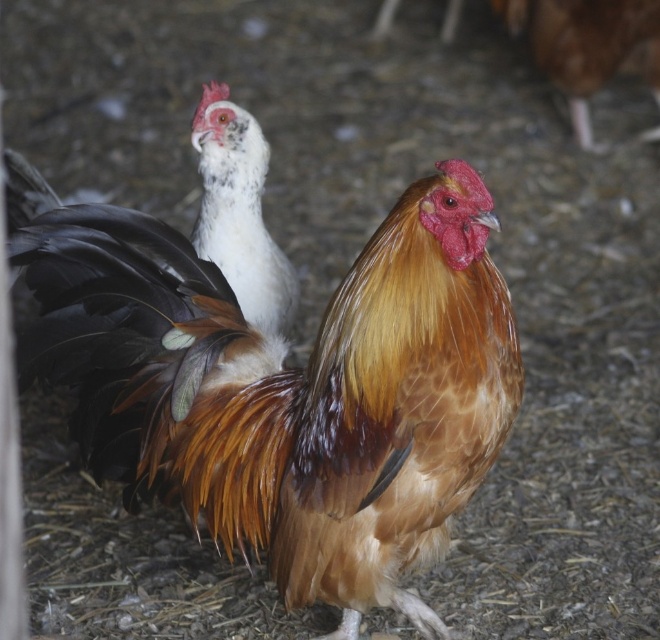
You are a farmer checking the coop and notice the brown feathered rooster at center and the white feathered chicken at upper left. Which one is larger in size?

The brown feathered rooster at center is bigger than the white feathered chicken at upper left.

You are a farmer checking on your chickens. You notice the brown feathered rooster at center and the white feathered chicken at upper left. Which chicken is closer to you?

The brown feathered rooster at center is closer to you because it is in front of the white feathered chicken at upper left.